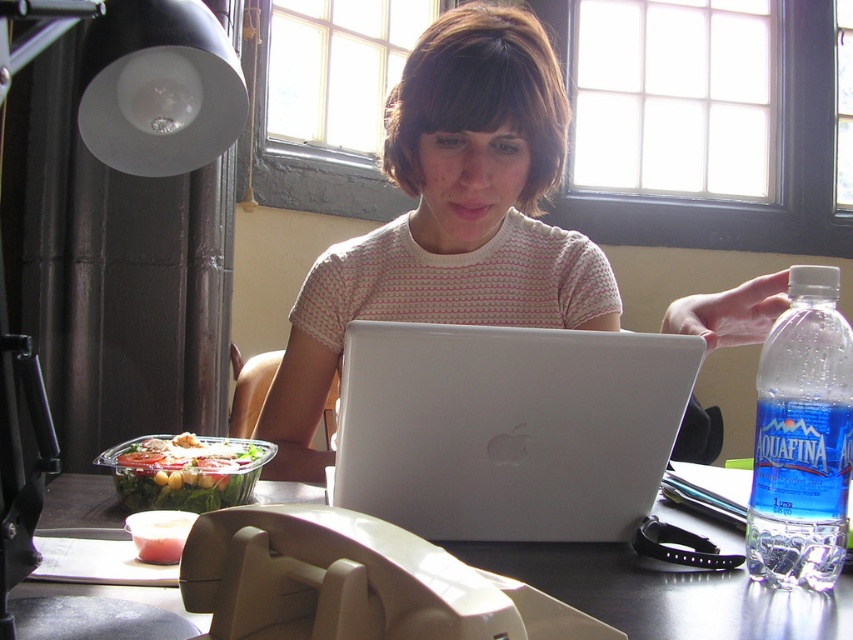
Question: Can you confirm if matte white laptop at center is positioned above black plastic table at center?

Choices:
 (A) no
 (B) yes

Answer: (B)

Question: In this image, where is white matte laptop at center located relative to black plastic table at center?

Choices:
 (A) below
 (B) above

Answer: (B)

Question: Which point appears farthest from the camera in this image?

Choices:
 (A) (793, 496)
 (B) (653, 612)
 (C) (212, 496)

Answer: (C)

Question: Among these objects, which one is farthest from the camera?

Choices:
 (A) white matte laptop at center
 (B) blue transparent bottle at right
 (C) black plastic table at center
 (D) fresh green salad at left

Answer: (D)

Question: Which point appears closest to the camera in this image?

Choices:
 (A) (495, 518)
 (B) (477, 10)
 (C) (194, 440)
 (D) (764, 353)

Answer: (D)

Question: Can you confirm if blue transparent bottle at right is smaller than fresh green salad at left?

Choices:
 (A) yes
 (B) no

Answer: (A)